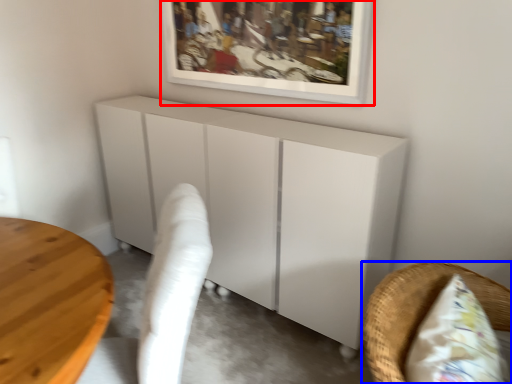
Question: Among these objects, which one is nearest to the camera, picture frame (highlighted by a red box) or furniture (highlighted by a blue box)?

Choices:
 (A) picture frame
 (B) furniture

Answer: (B)